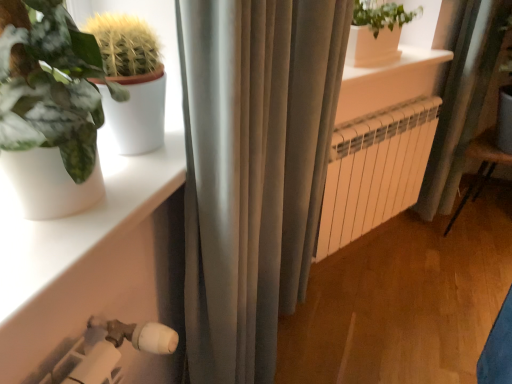
At what (x,y) coordinates should I click in order to perform the action: click on vacant space underneath white metallic radiator at center (from a real-world perspective). Please return your answer as a coordinate pair (x, y). Looking at the image, I should click on (364, 254).